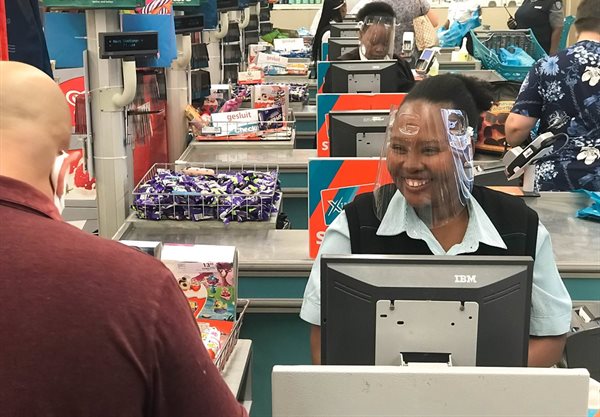
At what (x,y) coordinates should I click in order to perform the action: click on counter. Please return your answer as a coordinate pair (x, y). This screenshot has width=600, height=417. Looking at the image, I should click on (258, 248), (286, 152), (303, 106), (308, 76), (306, 57).